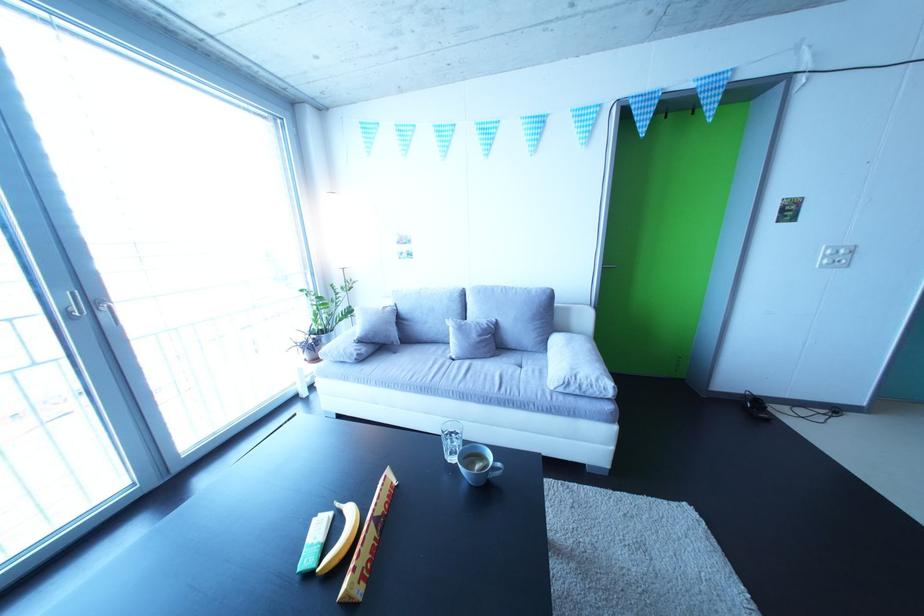
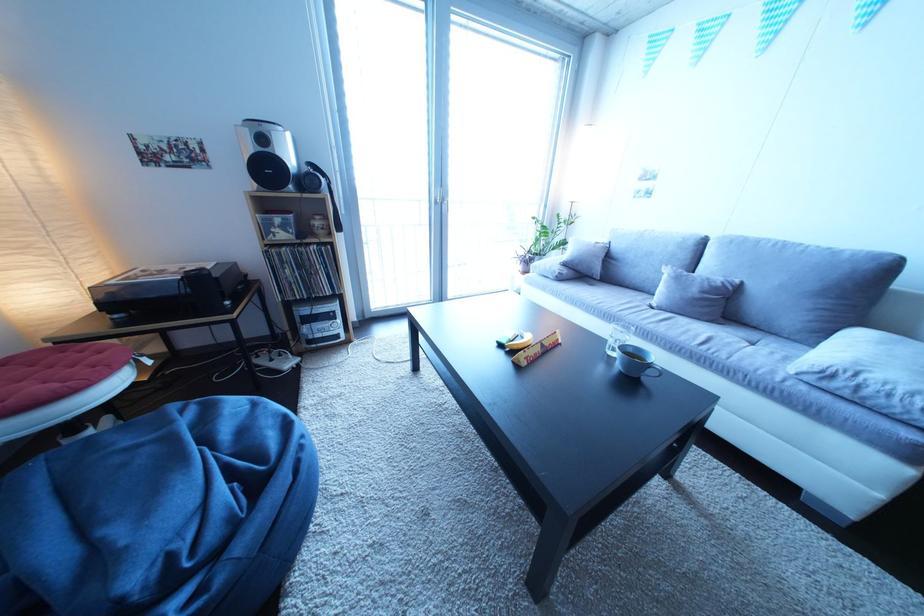
Where in the second image is the point corresponding to pixel 506 326 from the first image?

(750, 286)